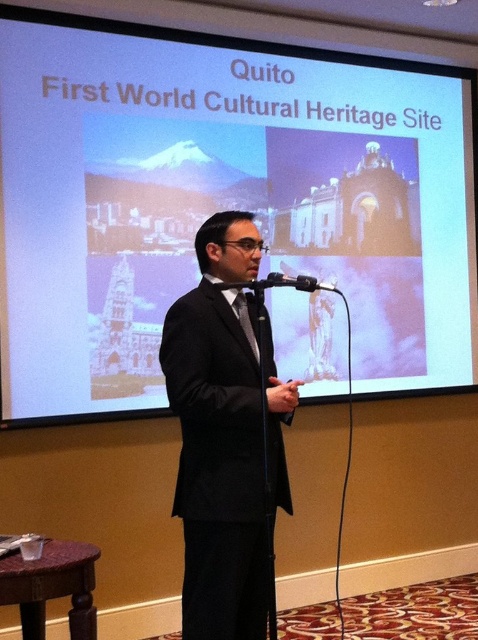
You are attending a presentation and need to sit down. There is a brown wood stool at lower left and a black satin tie at center. Which object is closer to you so you can reach it easily?

The brown wood stool at lower left is closer to the viewer than the black satin tie at center, so you can reach it easily.

You are an event organizer who needs to place a name tag on either the brown wood stool at lower left or the black satin tie at center. Which object is taller so that the name tag will be more visible to the audience?

The brown wood stool at lower left has a greater height compared to the black satin tie at center, so placing the name tag on the brown wood stool at lower left will make it more visible to the audience.

Looking at this image, you are an event organizer setting up a conference room. You have a brown wood stool at lower left and a black matte microphone at center. Where should you place the stool relative to the microphone to match the image?

The brown wood stool at lower left should be placed on the left side of the black matte microphone at center as shown in the image.